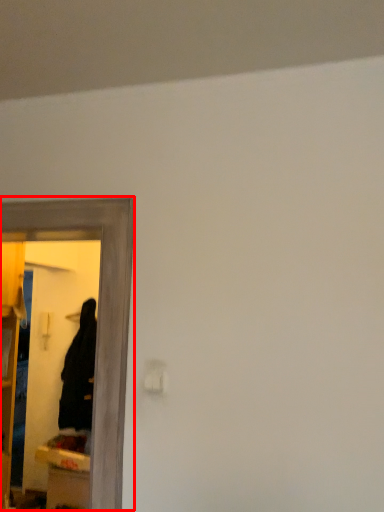
Question: From the image, what is the correct spatial relationship of mirror (annotated by the red box) in relation to robe?

Choices:
 (A) left
 (B) right

Answer: (B)